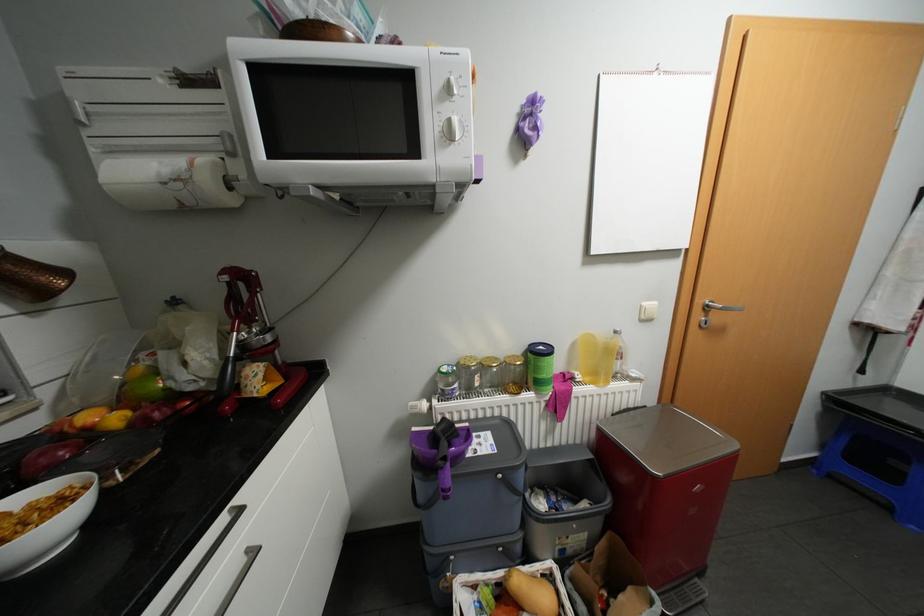
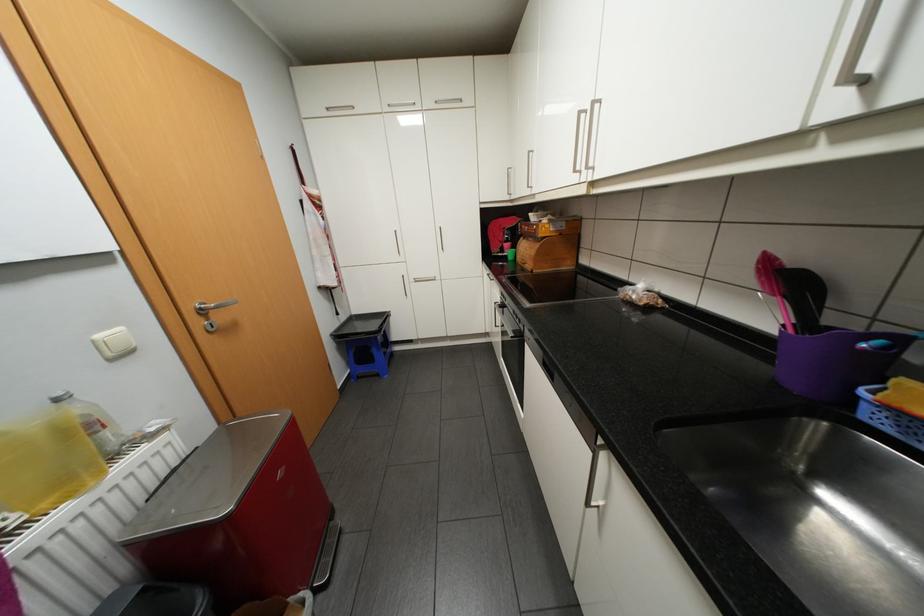
In the second image, find the point that corresponds to point (594, 378) in the first image.

(53, 504)